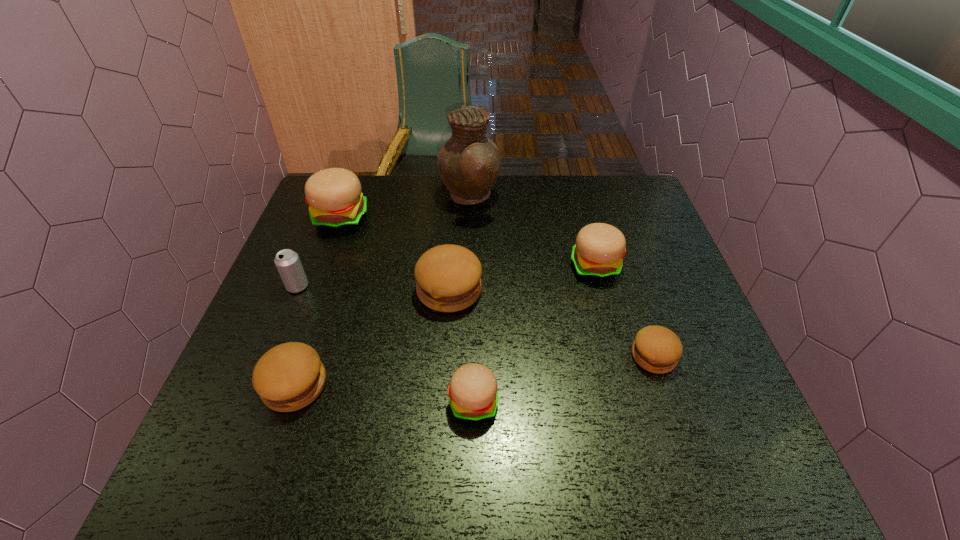
This screenshot has height=540, width=960. I want to click on the tallest object, so click(x=469, y=163).

At what (x,y) coordinates should I click in order to perform the action: click on brown pitcher. Please return your answer as a coordinate pair (x, y). Looking at the image, I should click on (469, 163).

Locate an element on the screen. The width and height of the screenshot is (960, 540). the seventh shortest object is located at coordinates (334, 196).

Find the location of a particular element. The image size is (960, 540). the biggest beige hamburger is located at coordinates 334,196.

Locate an element on the screen. The width and height of the screenshot is (960, 540). the second smallest beige hamburger is located at coordinates (597, 254).

The height and width of the screenshot is (540, 960). In order to click on the second farthest beige hamburger in this screenshot , I will do `click(597, 254)`.

You are a GUI agent. You are given a task and a screenshot of the screen. Output one action in this format:
    pyautogui.click(x=<x>, y=<y>)
    Task: Click on the biggest brown hamburger
    
    Given the screenshot: What is the action you would take?
    pyautogui.click(x=448, y=277)

In order to click on the second brown hamburger from right to left in this screenshot , I will do `click(448, 277)`.

The width and height of the screenshot is (960, 540). In order to click on white beer can in this screenshot , I will do `click(288, 264)`.

This screenshot has height=540, width=960. In order to click on the leftmost brown hamburger in this screenshot , I will do `click(288, 377)`.